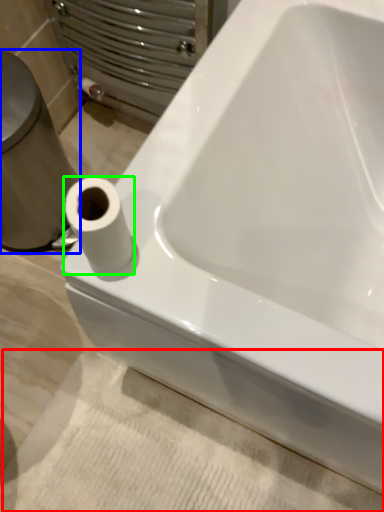
Question: Estimate the real-world distances between objects in this image. Which object is farther from bath mat (highlighted by a red box), porcelain (highlighted by a blue box) or toilet paper (highlighted by a green box)?

Choices:
 (A) porcelain
 (B) toilet paper

Answer: (B)